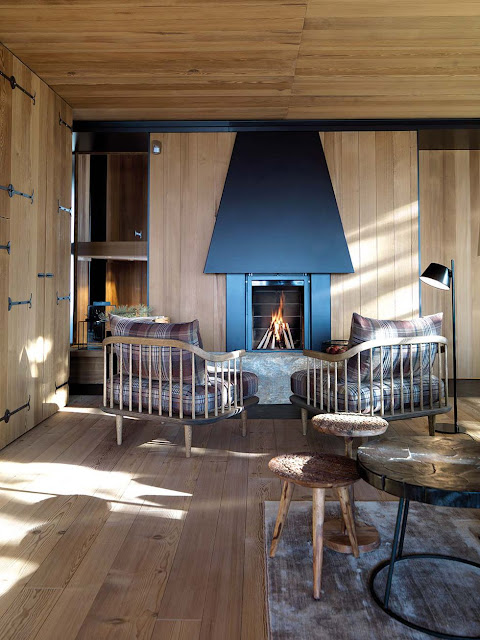
At what (x,y) coordinates should I click in order to perform the action: click on fireplace. Please return your answer as a coordinate pair (x, y). This screenshot has width=480, height=640. Looking at the image, I should click on (274, 336).